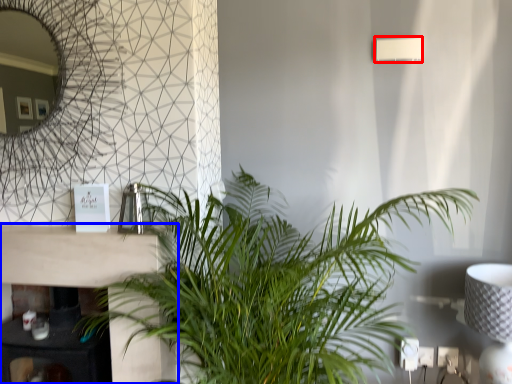
Question: Which object appears farthest to the camera in this image, lamp (highlighted by a red box) or table (highlighted by a blue box)?

Choices:
 (A) lamp
 (B) table

Answer: (A)